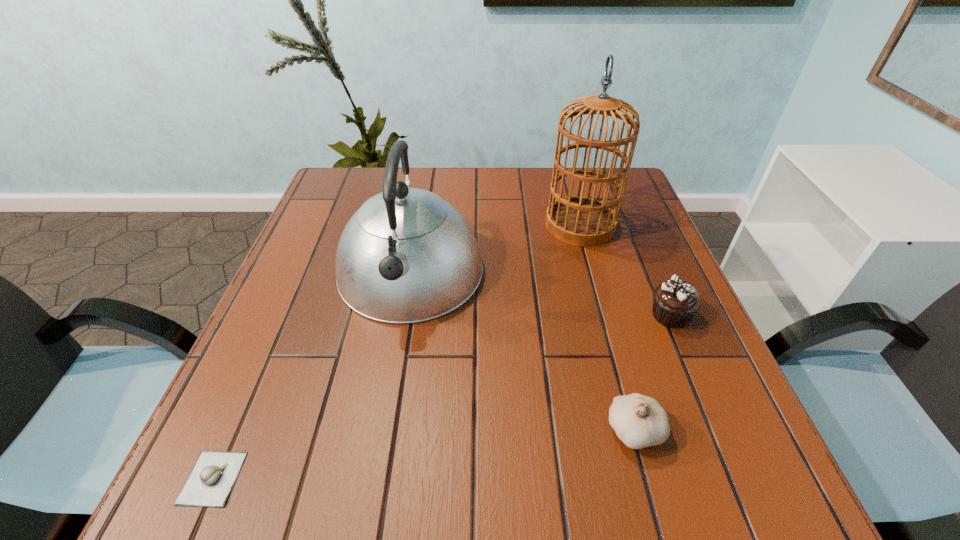
The width and height of the screenshot is (960, 540). What are the coordinates of `birdcage` in the screenshot? It's located at (579, 220).

Locate an element on the screen. kettle is located at coordinates (406, 255).

Locate an element on the screen. This screenshot has height=540, width=960. the fourth object from right to left is located at coordinates (406, 255).

Find the location of `the rightmost object`. the rightmost object is located at coordinates (675, 302).

At what (x,y) coordinates should I click in order to perform the action: click on the taller garlic. Please return your answer as a coordinate pair (x, y). This screenshot has width=960, height=540. Looking at the image, I should click on (639, 421).

I want to click on the leftmost object, so click(210, 482).

The width and height of the screenshot is (960, 540). I want to click on the shortest object, so click(210, 482).

This screenshot has width=960, height=540. I want to click on free point located 0.250m on the left of the tallest object, so click(448, 225).

You are a GUI agent. You are given a task and a screenshot of the screen. Output one action in this format:
    pyautogui.click(x=<x>, y=<y>)
    Task: Click on the vacant area situated from the spout of the fourth object from right to left
    
    Given the screenshot: What is the action you would take?
    pyautogui.click(x=376, y=471)

Identify the location of vacant space located on the left of the cupcake. This screenshot has width=960, height=540. (581, 315).